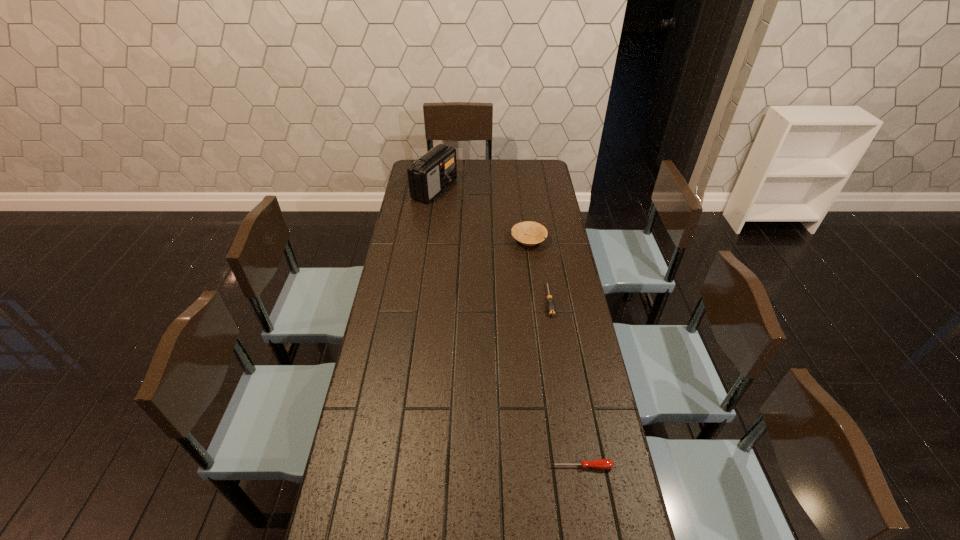
Locate an element on the screen. The image size is (960, 540). object that is positioned at the far edge is located at coordinates (428, 176).

Identify the location of object present at the left edge. This screenshot has height=540, width=960. (428, 176).

The height and width of the screenshot is (540, 960). What are the coordinates of `bowl positioned at the right edge` in the screenshot? It's located at (535, 233).

What are the coordinates of `object situated at the far left corner` in the screenshot? It's located at (428, 176).

In the image, there is a desktop. At what (x,y) coordinates should I click in order to perform the action: click on vacant space at the far edge. Please return your answer as a coordinate pair (x, y). The width and height of the screenshot is (960, 540). Looking at the image, I should click on (469, 181).

Where is `blank space at the left edge of the desktop`? blank space at the left edge of the desktop is located at coordinates (369, 537).

Where is `vacant space at the right edge of the desktop`? This screenshot has width=960, height=540. vacant space at the right edge of the desktop is located at coordinates (570, 287).

At what (x,y) coordinates should I click in order to perform the action: click on free spot between the leftmost object and the bowl. Please return your answer as a coordinate pair (x, y). Looking at the image, I should click on (482, 215).

In order to click on free spot between the nearest object and the farther screwdriver in this screenshot , I will do `click(565, 383)`.

Locate an element on the screen. The height and width of the screenshot is (540, 960). free space between the farthest object and the farther screwdriver is located at coordinates (492, 245).